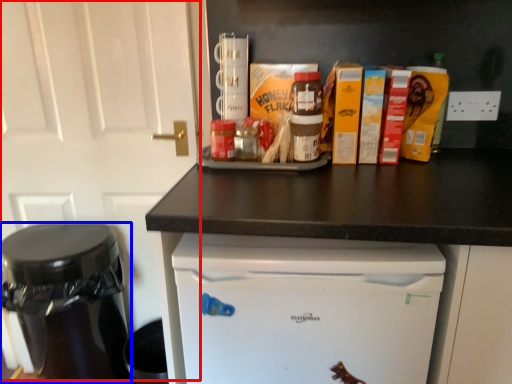
Question: Which object appears closest to the camera in this image, door (highlighted by a red box) or appliance (highlighted by a blue box)?

Choices:
 (A) door
 (B) appliance

Answer: (A)